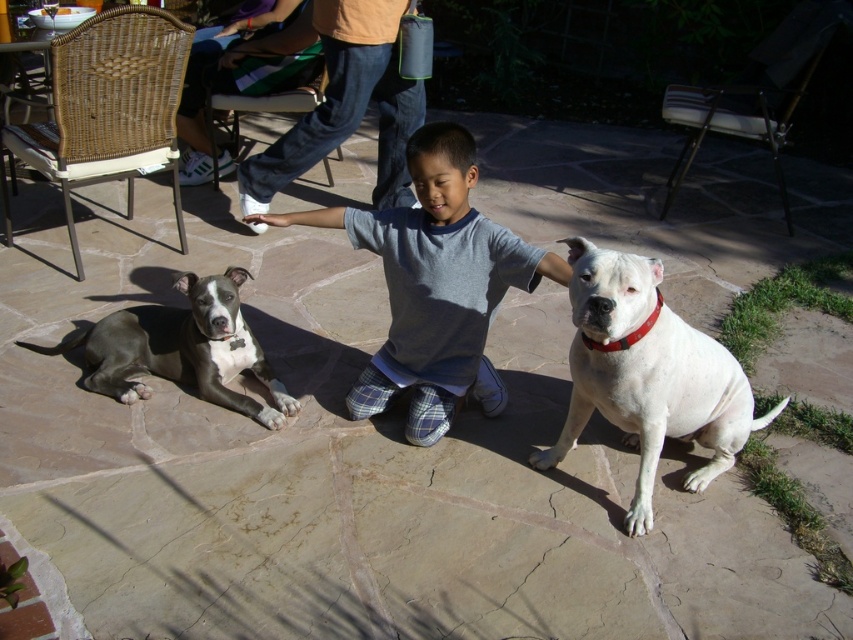
Is point (575, 289) more distant than point (126, 385)?

No.

Between white smooth dog at center and gray smooth pit bull at left, which one has less height?

With less height is gray smooth pit bull at left.

Between point (697, 337) and point (129, 397), which one is positioned behind?

The point (129, 397) is behind.

I want to click on white smooth dog at center, so click(647, 374).

Which is more to the right, gray cotton shirt at center or white smooth dog at center?

From the viewer's perspective, white smooth dog at center appears more on the right side.

The image size is (853, 640). What do you see at coordinates (434, 285) in the screenshot?
I see `gray cotton shirt at center` at bounding box center [434, 285].

You are a GUI agent. You are given a task and a screenshot of the screen. Output one action in this format:
    pyautogui.click(x=<x>, y=<y>)
    Task: Click on the gray cotton shirt at center
    
    Given the screenshot: What is the action you would take?
    pyautogui.click(x=434, y=285)

You are a GUI agent. You are given a task and a screenshot of the screen. Output one action in this format:
    pyautogui.click(x=<x>, y=<y>)
    Task: Click on the gray cotton shirt at center
    The width and height of the screenshot is (853, 640).
    Given the screenshot: What is the action you would take?
    pyautogui.click(x=434, y=285)

Does gray cotton shirt at center have a greater width compared to gray smooth pit bull at left?

Incorrect, gray cotton shirt at center's width does not surpass gray smooth pit bull at left's.

The height and width of the screenshot is (640, 853). I want to click on gray cotton shirt at center, so click(x=434, y=285).

You are a GUI agent. You are given a task and a screenshot of the screen. Output one action in this format:
    pyautogui.click(x=<x>, y=<y>)
    Task: Click on the gray cotton shirt at center
    The image size is (853, 640).
    Given the screenshot: What is the action you would take?
    434,285

Find the location of a particular element. The image size is (853, 640). gray cotton shirt at center is located at coordinates (434, 285).